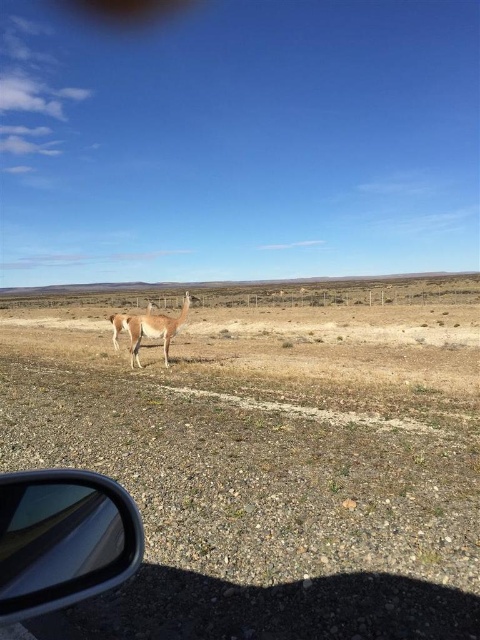
Between point (144, 323) and point (117, 336), which one is positioned behind?

Point (117, 336)

Based on the photo, who is higher up, light brown fur at center or fuzzy brown alpaca at center?

Positioned higher is light brown fur at center.

Where is `light brown fur at center`? The image size is (480, 640). light brown fur at center is located at coordinates (152, 328).

Which of these two, transparent plastic side mirror at lower left or fuzzy brown alpaca at center, stands shorter?

With less height is transparent plastic side mirror at lower left.

Based on the photo, can you confirm if transparent plastic side mirror at lower left is positioned to the right of fuzzy brown alpaca at center?

Correct, you'll find transparent plastic side mirror at lower left to the right of fuzzy brown alpaca at center.

Find the location of `transparent plastic side mirror at lower left`. transparent plastic side mirror at lower left is located at coordinates (62, 540).

Who is more forward, (39, 547) or (170, 332)?

Point (39, 547) is more forward.

Is transparent plastic side mirror at lower left taller than light brown fur at center?

Incorrect, transparent plastic side mirror at lower left's height is not larger of light brown fur at center's.

Find the location of `transparent plastic side mirror at lower left`. transparent plastic side mirror at lower left is located at coordinates click(62, 540).